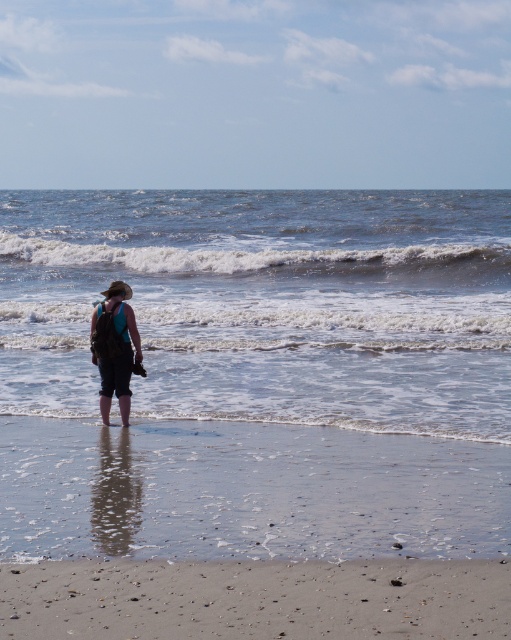
Between clear water at lower center and matte black backpack at center, which one has less height?

With less height is matte black backpack at center.

Can you confirm if clear water at lower center is positioned to the left of matte black backpack at center?

No, clear water at lower center is not to the left of matte black backpack at center.

The height and width of the screenshot is (640, 511). Find the location of `clear water at lower center`. clear water at lower center is located at coordinates (267, 305).

Identify the location of clear water at lower center. This screenshot has height=640, width=511. (267, 305).

Can you confirm if clear water at lower center is thinner than smooth beige sand at lower center?

In fact, clear water at lower center might be wider than smooth beige sand at lower center.

Does clear water at lower center have a larger size compared to smooth beige sand at lower center?

Yes.

Describe the element at coordinates (267, 305) in the screenshot. I see `clear water at lower center` at that location.

Identify the location of clear water at lower center. point(267,305).

Can you confirm if smooth beige sand at lower center is shorter than matte black backpack at center?

Yes.

Can you confirm if smooth beige sand at lower center is bigger than matte black backpack at center?

Yes.

The image size is (511, 640). I want to click on smooth beige sand at lower center, so click(256, 600).